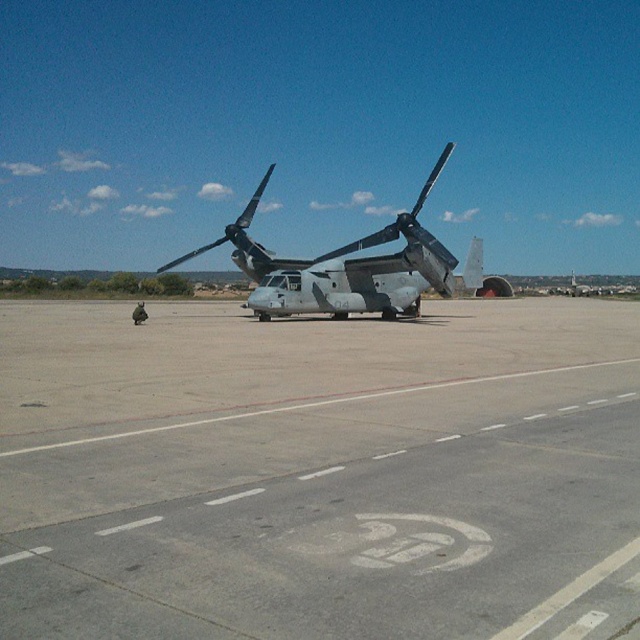
Question: Can you confirm if gray concrete tarmac at center is positioned to the right of camouflage fabric propeller at center?

Choices:
 (A) yes
 (B) no

Answer: (A)

Question: Can you confirm if gray concrete tarmac at center is bigger than camouflage fabric helicopter at center?

Choices:
 (A) no
 (B) yes

Answer: (A)

Question: Which object is positioned farthest from the camouflage fabric helicopter at center?

Choices:
 (A) camouflage fabric propeller at center
 (B) gray concrete tarmac at center

Answer: (B)

Question: In this image, where is camouflage fabric helicopter at center located relative to camouflage fabric propeller at center?

Choices:
 (A) below
 (B) above

Answer: (B)

Question: Considering the real-world distances, which object is closest to the gray concrete tarmac at center?

Choices:
 (A) camouflage fabric helicopter at center
 (B) camouflage fabric propeller at center

Answer: (A)

Question: Which of the following is the farthest from the observer?

Choices:
 (A) camouflage fabric propeller at center
 (B) gray concrete tarmac at center

Answer: (A)